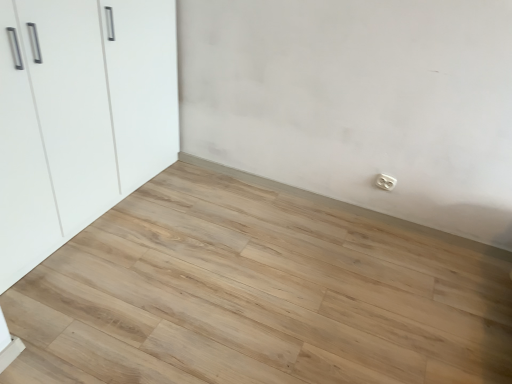
This screenshot has width=512, height=384. What are the coordinates of `natural wood floor at center` in the screenshot? It's located at (256, 296).

What do you see at coordinates (385, 182) in the screenshot? The width and height of the screenshot is (512, 384). I see `white plastic electric outlet at lower right` at bounding box center [385, 182].

The height and width of the screenshot is (384, 512). What are the coordinates of `white glossy cupboard at left` in the screenshot? It's located at (80, 116).

Does white plastic electric outlet at lower right turn towards white glossy cupboard at left?

No, white plastic electric outlet at lower right is not aimed at white glossy cupboard at left.

Find the location of a particular element. cupboard that appears on the left of white plastic electric outlet at lower right is located at coordinates (80, 116).

Would you say white plastic electric outlet at lower right contains white glossy cupboard at left?

No, white glossy cupboard at left is located outside of white plastic electric outlet at lower right.

How many degrees apart are the facing directions of natural wood floor at center and white glossy cupboard at left?

The angular difference between natural wood floor at center and white glossy cupboard at left is 180 degrees.

Is natural wood floor at center further to camera compared to white glossy cupboard at left?

No.

Is point (275, 383) closer to viewer compared to point (66, 160)?

Yes, point (275, 383) is in front of point (66, 160).

Can you confirm if white glossy cupboard at left is smaller than white plastic electric outlet at lower right?

Actually, white glossy cupboard at left might be larger than white plastic electric outlet at lower right.

Is white plastic electric outlet at lower right at the back of white glossy cupboard at left?

No, white glossy cupboard at left is not facing the opposite direction of white plastic electric outlet at lower right.

Which object is more forward, white glossy cupboard at left or white plastic electric outlet at lower right?

white glossy cupboard at left.

Does point (392, 181) come closer to viewer compared to point (322, 290)?

No, it is behind (322, 290).

Is white plastic electric outlet at lower right looking in the opposite direction of natural wood floor at center?

That's not correct — white plastic electric outlet at lower right is not looking away from natural wood floor at center.

From the image's perspective, between white plastic electric outlet at lower right and natural wood floor at center, who is located below?

natural wood floor at center is shown below in the image.

Does white glossy cupboard at left have a lesser width compared to natural wood floor at center?

Yes, white glossy cupboard at left is thinner than natural wood floor at center.

Consider the image. Can you confirm if white glossy cupboard at left is shorter than natural wood floor at center?

In fact, white glossy cupboard at left may be taller than natural wood floor at center.

Is white glossy cupboard at left surrounding natural wood floor at center?

That's incorrect, natural wood floor at center is not inside white glossy cupboard at left.

Is white glossy cupboard at left placed right next to natural wood floor at center?

There is a gap between white glossy cupboard at left and natural wood floor at center.

Is natural wood floor at center positioned with its back to white plastic electric outlet at lower right?

natural wood floor at center does not have its back to white plastic electric outlet at lower right.

Is natural wood floor at center to the left of white plastic electric outlet at lower right from the viewer's perspective?

Indeed, natural wood floor at center is positioned on the left side of white plastic electric outlet at lower right.

Considering the relative positions of natural wood floor at center and white plastic electric outlet at lower right in the image provided, is natural wood floor at center in front of white plastic electric outlet at lower right?

Yes, it is in front of white plastic electric outlet at lower right.

In terms of width, does natural wood floor at center look wider or thinner when compared to white plastic electric outlet at lower right?

Clearly, natural wood floor at center has more width compared to white plastic electric outlet at lower right.

This screenshot has width=512, height=384. I want to click on electric outlet behind the white glossy cupboard at left, so click(385, 182).

Where is `plank below the white glossy cupboard at left (from the image's perspective)`? The width and height of the screenshot is (512, 384). plank below the white glossy cupboard at left (from the image's perspective) is located at coordinates (256, 296).

Looking at the image, which one is located further to white glossy cupboard at left, natural wood floor at center or white plastic electric outlet at lower right?

The object further to white glossy cupboard at left is white plastic electric outlet at lower right.

Consider the image. From the image, which object appears to be farther from white plastic electric outlet at lower right, natural wood floor at center or white glossy cupboard at left?

The object further to white plastic electric outlet at lower right is white glossy cupboard at left.

From the image, which object appears to be nearer to natural wood floor at center, white plastic electric outlet at lower right or white glossy cupboard at left?

Among the two, white glossy cupboard at left is located nearer to natural wood floor at center.

Looking at the image, which one is located further to white glossy cupboard at left, white plastic electric outlet at lower right or natural wood floor at center?

white plastic electric outlet at lower right is further to white glossy cupboard at left.

Looking at the image, which one is located closer to white plastic electric outlet at lower right, white glossy cupboard at left or natural wood floor at center?

natural wood floor at center is closer to white plastic electric outlet at lower right.

When comparing their distances from natural wood floor at center, does white glossy cupboard at left or white plastic electric outlet at lower right seem closer?

The object closer to natural wood floor at center is white glossy cupboard at left.

Locate an element on the screen. plank between white glossy cupboard at left and white plastic electric outlet at lower right is located at coordinates click(x=256, y=296).